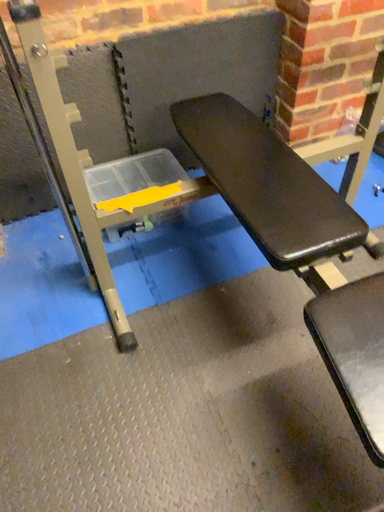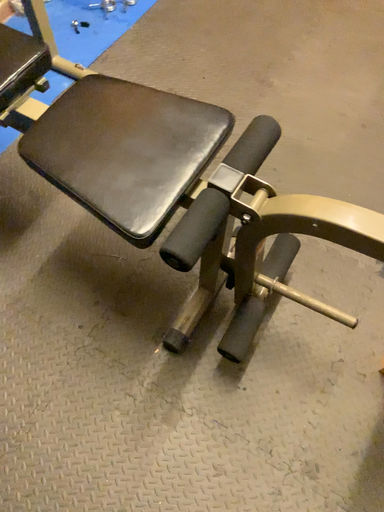
Question: Which way did the camera rotate in the video?

Choices:
 (A) rotated downward
 (B) rotated upward

Answer: (A)